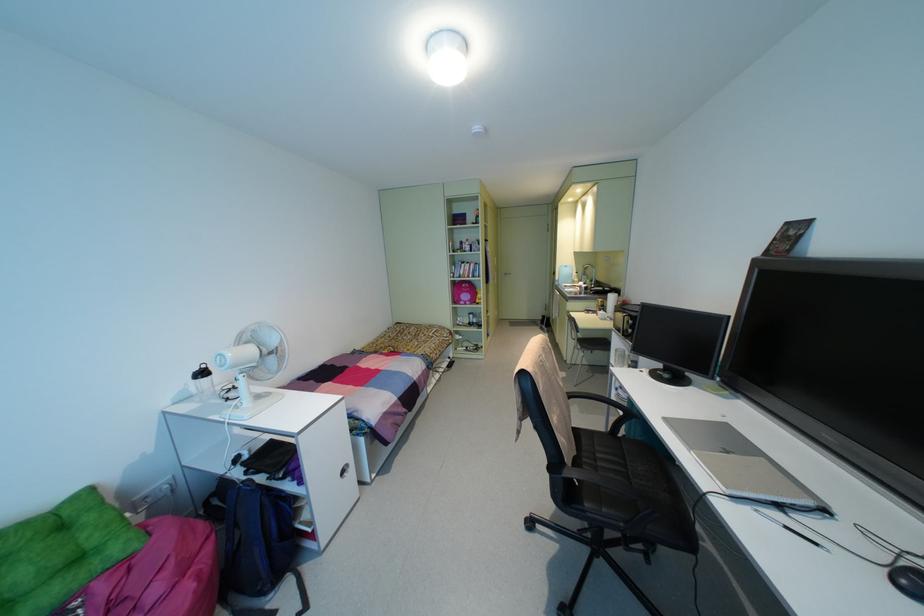
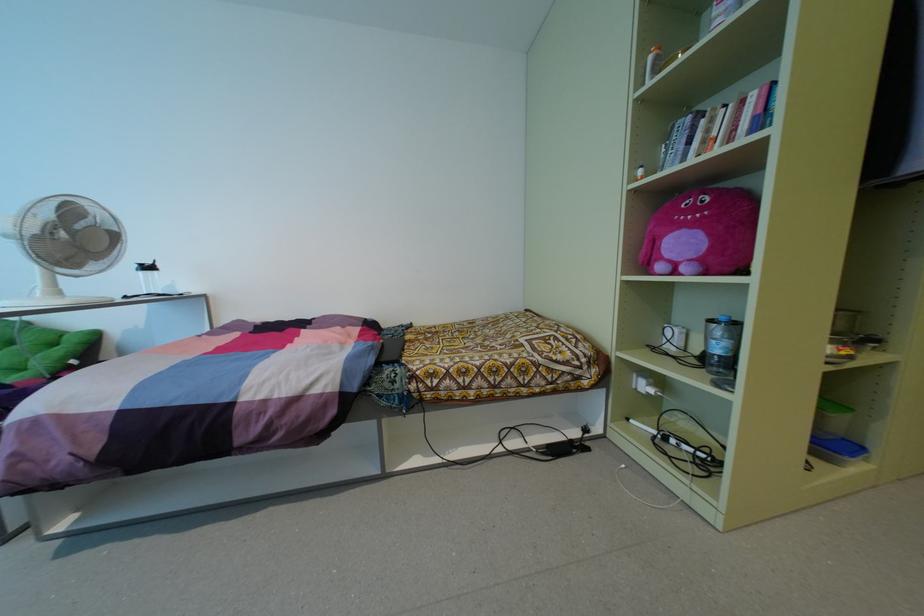
Find the pixel in the second image that matches the point at 465,286 in the first image.

(691, 209)